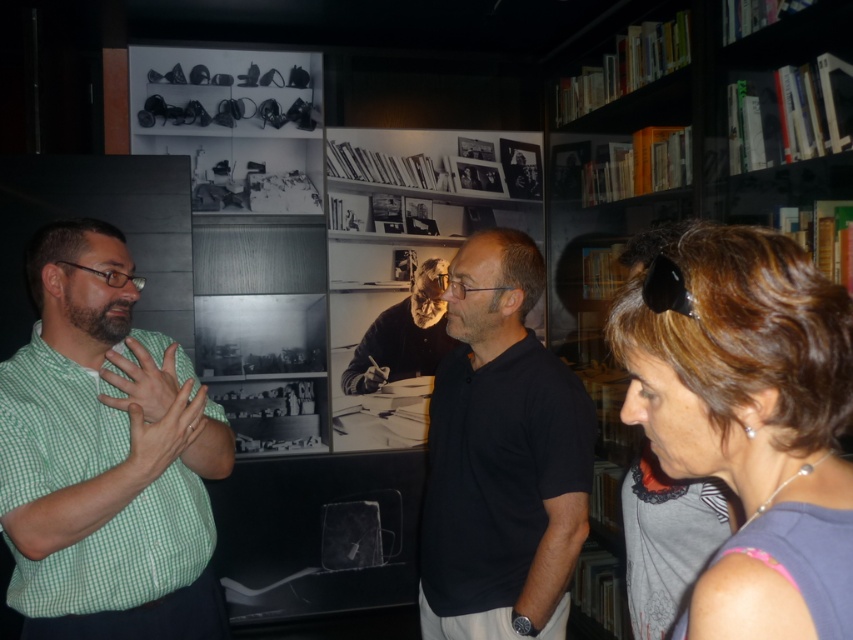
Question: Which object is the closest to the dark gray sweater at center?

Choices:
 (A) gray fabric shirt at right
 (B) green checkered shirt at left
 (C) black matte shirt at center

Answer: (C)

Question: Which of these objects is positioned closest to the dark gray sweater at center?

Choices:
 (A) black matte shirt at center
 (B) green checkered shirt at left
 (C) gray fabric shirt at right

Answer: (A)

Question: Can you confirm if black matte shirt at center is smaller than dark gray sweater at center?

Choices:
 (A) no
 (B) yes

Answer: (A)

Question: Is gray fabric shirt at right to the left of black matte shirt at center from the viewer's perspective?

Choices:
 (A) yes
 (B) no

Answer: (B)

Question: Does green checkered shirt at left have a lesser width compared to gray fabric shirt at right?

Choices:
 (A) no
 (B) yes

Answer: (A)

Question: Among these points, which one is farthest from the camera?

Choices:
 (A) (456, 340)
 (B) (556, 394)

Answer: (A)